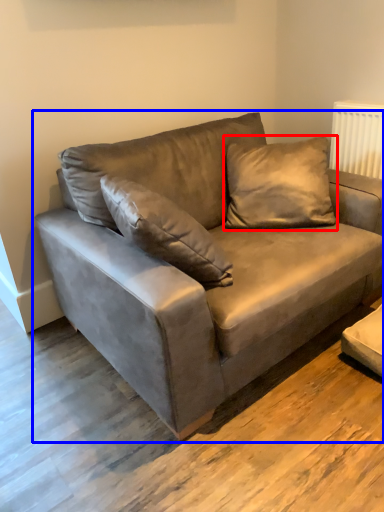
Question: Among these objects, which one is farthest to the camera, pillow (highlighted by a red box) or studio couch (highlighted by a blue box)?

Choices:
 (A) pillow
 (B) studio couch

Answer: (A)